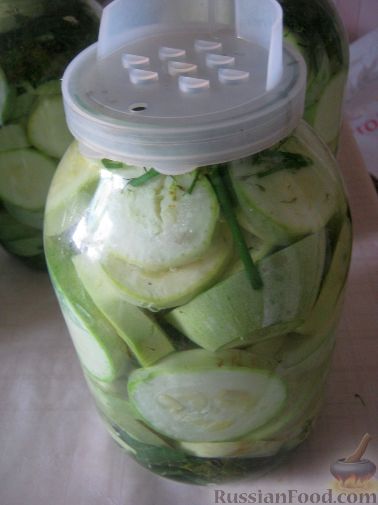
This screenshot has width=378, height=505. I want to click on cooking pot, so click(x=366, y=468).